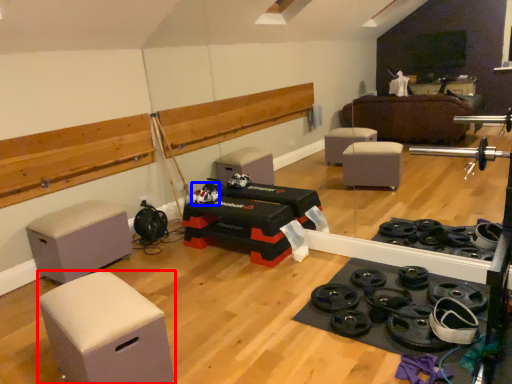
Question: Which object appears closest to the camera in this image, furniture (highlighted by a red box) or toy (highlighted by a blue box)?

Choices:
 (A) furniture
 (B) toy

Answer: (A)